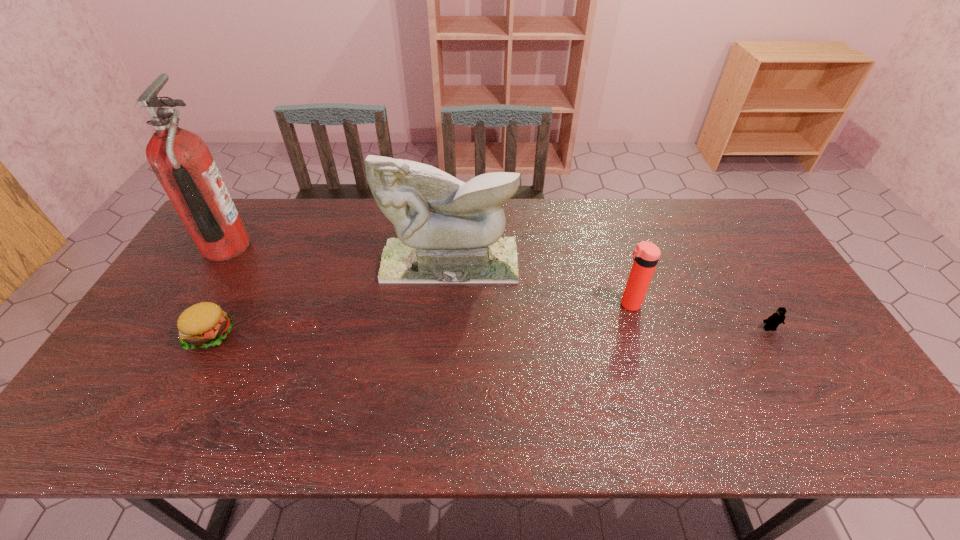
Find the location of a particular element. vacant space in between the tallest object and the rightmost object is located at coordinates (497, 288).

The height and width of the screenshot is (540, 960). I want to click on free space between the hamburger and the third shortest object, so click(x=420, y=320).

Find the location of a particular element. free space between the rightmost object and the thermos bottle is located at coordinates (699, 316).

Choose which object is the second nearest neighbor to the hamburger. Please provide its 2D coordinates. Your answer should be formatted as a tuple, i.e. [(x, y)], where the tuple contains the x and y coordinates of a point satisfying the conditions above.

[(449, 231)]

Image resolution: width=960 pixels, height=540 pixels. I want to click on object that is the fourth closest one to the tallest object, so click(771, 323).

Where is `free space that satisfies the following two spatial constraints: 1. on the front of the hamburger near the operation label; 2. on the right side of the fire extinguisher`? The height and width of the screenshot is (540, 960). free space that satisfies the following two spatial constraints: 1. on the front of the hamburger near the operation label; 2. on the right side of the fire extinguisher is located at coordinates (172, 335).

Where is `vacant region that satisfies the following two spatial constraints: 1. on the front of the hamburger near the operation label; 2. on the left side of the fire extinguisher`? This screenshot has width=960, height=540. vacant region that satisfies the following two spatial constraints: 1. on the front of the hamburger near the operation label; 2. on the left side of the fire extinguisher is located at coordinates (172, 335).

Locate an element on the screen. The height and width of the screenshot is (540, 960). vacant space that satisfies the following two spatial constraints: 1. on the back side of the third farthest object; 2. on the front of the tallest object near the operation label is located at coordinates (611, 247).

What are the coordinates of `vacant space that satisfies the following two spatial constraints: 1. on the base of the sculpture; 2. on the right side of the second object from right to left` in the screenshot? It's located at (447, 304).